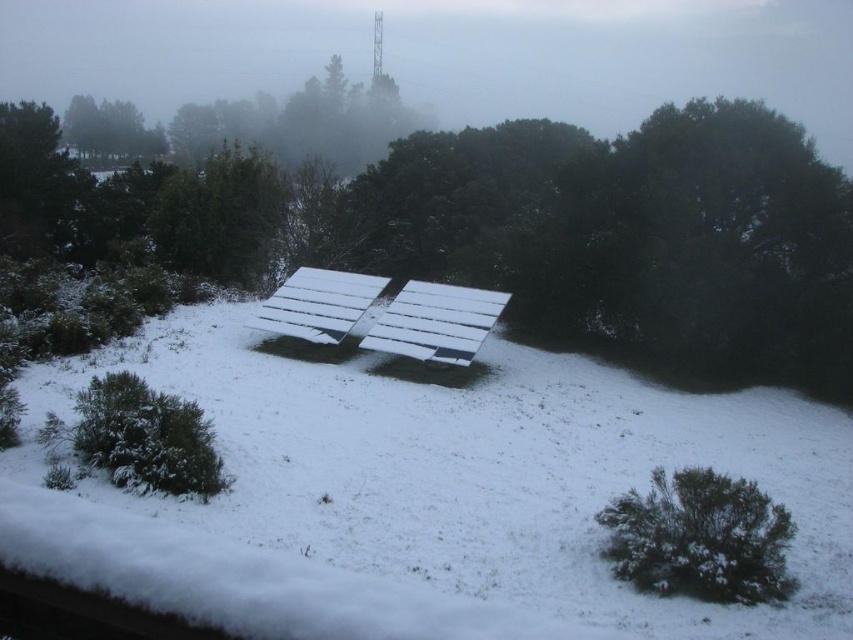
You are standing at the center of the snowy landscape and want to walk to the green bush at lower right. Which direction should you move relative to the green matte tree at upper left?

The green bush at lower right is positioned on the right side of the green matte tree at upper left, so you should move to the right relative to the green matte tree at upper left to reach the green bush at lower right.

You are planning to place a small garden statue that requires a space of 1 square meter. Based on the scene, which object between the green bush at lower right and the green matte tree at upper left would be suitable for placing the statue next to without overcrowding the area?

The green bush at lower right occupies less space than the green matte tree at upper left, so placing the statue next to the green bush at lower right would be more suitable as it requires less space and would prevent overcrowding.

You are a maintenance worker who needs to reach both the white matte solar panel at center and the white plastic bench at center. The path between them is clear except for a small snowdrift that is 3 feet wide. Can you walk from one to the other without stepping in the snowdrift?

The white matte solar panel at center and white plastic bench at center are 7.64 feet apart from each other. Since the snowdrift is only 3 feet wide, there is enough space between them to walk around the snowdrift and reach both objects without stepping into it.